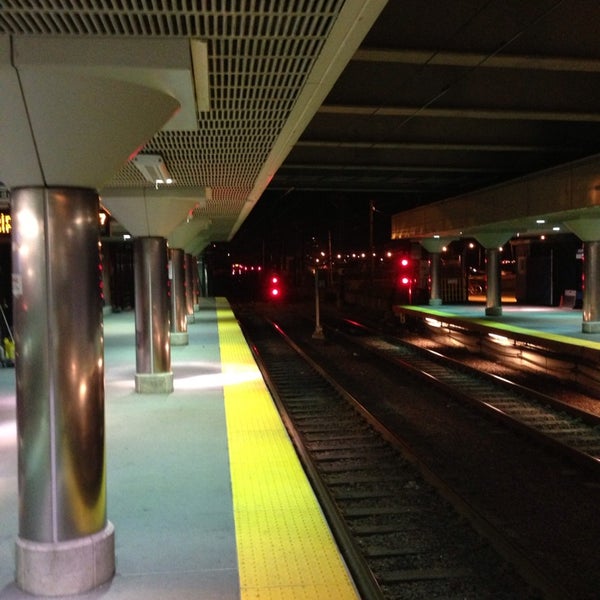
Where is `yellow paint on cement`? yellow paint on cement is located at coordinates (252, 476), (514, 330).